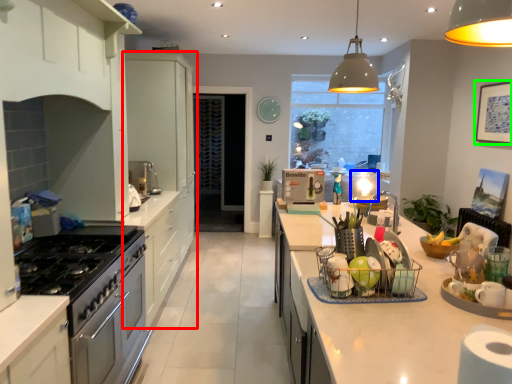
Question: Based on their relative distances, which object is nearer to cabinetry (highlighted by a red box)? Choose from appliance (highlighted by a blue box) and picture frame (highlighted by a green box).

Choices:
 (A) appliance
 (B) picture frame

Answer: (A)